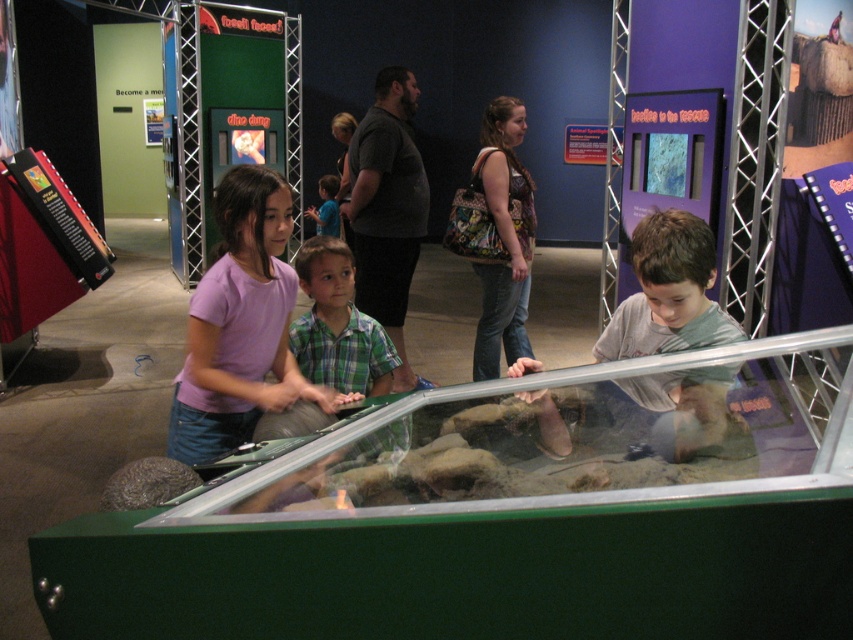
In the scene shown: Is gray matte shirt at center above green plaid shirt at center?

Actually, gray matte shirt at center is below green plaid shirt at center.

Can you confirm if gray matte shirt at center is thinner than green plaid shirt at center?

No, gray matte shirt at center is not thinner than green plaid shirt at center.

Is point (654, 404) closer to camera compared to point (329, 202)?

Yes, point (654, 404) is closer to viewer.

At what (x,y) coordinates should I click in order to perform the action: click on gray matte shirt at center. Please return your answer as a coordinate pair (x, y). This screenshot has height=640, width=853. Looking at the image, I should click on (668, 292).

Can you confirm if green matte glass box at center is bigger than pink cotton shirt at center?

Correct, green matte glass box at center is larger in size than pink cotton shirt at center.

In the scene shown: Is green matte glass box at center taller than pink cotton shirt at center?

No.

Does point (171, 593) come in front of point (256, 392)?

Yes, point (171, 593) is closer to viewer.

Find the location of a particular element. green matte glass box at center is located at coordinates (508, 516).

Between green matte glass box at center and green plaid shirt at center, which one appears on the left side from the viewer's perspective?

Positioned to the left is green plaid shirt at center.

Between green matte glass box at center and green plaid shirt at center, which one is positioned higher?

Positioned higher is green plaid shirt at center.

This screenshot has width=853, height=640. Find the location of `green matte glass box at center`. green matte glass box at center is located at coordinates (508, 516).

The width and height of the screenshot is (853, 640). Identify the location of green matte glass box at center. (508, 516).